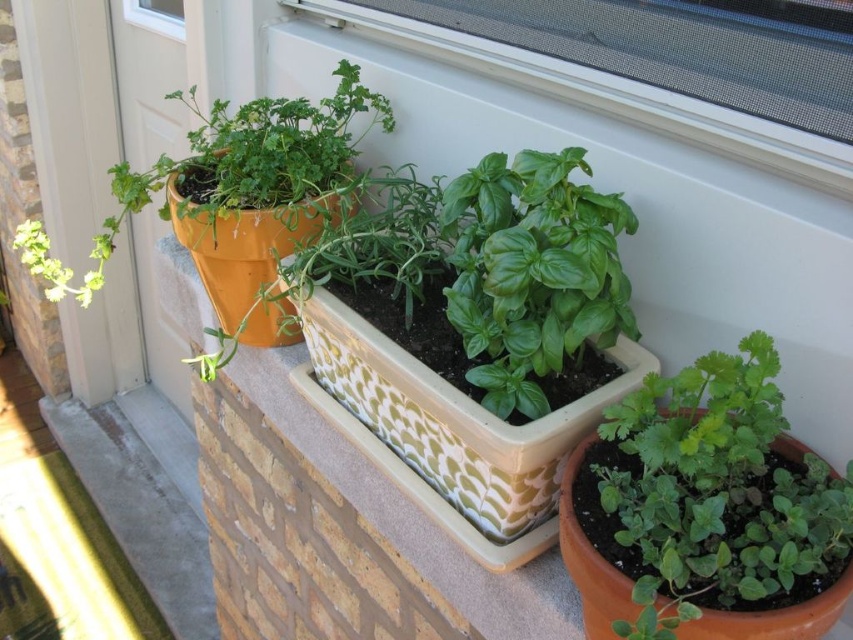
You are trying to place a new small herb pot that is 10 cm wide in the garden. Looking at the green matte herb at lower right and the transparent plastic window at upper center, which location has enough space for the new herb pot?

The transparent plastic window at upper center has sufficient space because its width is greater than the green matte herb at lower right, which is narrower and cannot accommodate the 10 cm wide herb pot.

You are designing a layout for a garden display and want to ensure proper spacing between the white textured rectangular planter at center and the matte orange pot at left. Given their sizes, which planter requires more horizontal space to accommodate its width?

The matte orange pot at left requires more horizontal space because it has a greater width than the white textured rectangular planter at center.

You are a gardener who needs to water the plants. You have a watering can in your left hand and a spray bottle in your right. The green glossy basil at center is in the middle, and the green matte herb at lower right is at the edge. Which plant should you water first if you want to avoid spilling water on the other plants?

You should water the green glossy basil at center first because the green matte herb at lower right is in front of it. Watering the one behind first might cause water to drip onto the front plant.